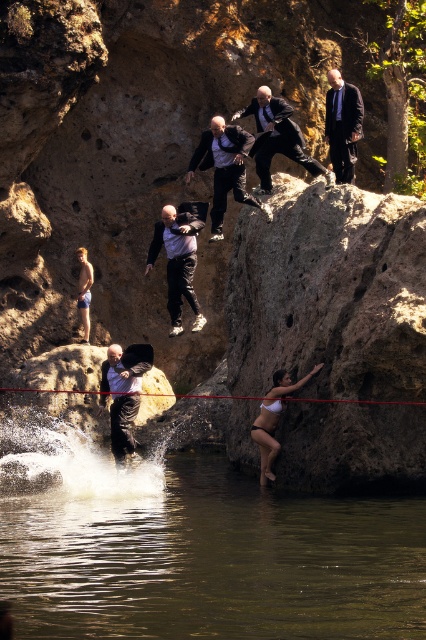
You are a photographer standing at the edge of the cliff. You see the black matte pants at lower left and a camera. Which object is closer to you?

The black matte pants at lower left are closer to you since they are only 40.84 meters away from the camera, which is farther away.

What is located at the point with coordinates (126, 368) in the image?

The point at coordinates (126, 368) marks the location of black matte pants at lower left.

You are a photographer positioned at the edge of the cliff. You need to capture a photo that includes both the black leather pants at center and the white matte bikini at lower center. Given that your camera has a maximum focus range of 18 feet, will you be able to get both subjects in focus at the same time?

The black leather pants at center and white matte bikini at lower center are 19.11 feet apart. Since the maximum focus range is 18 feet, the camera cannot focus on both subjects simultaneously.